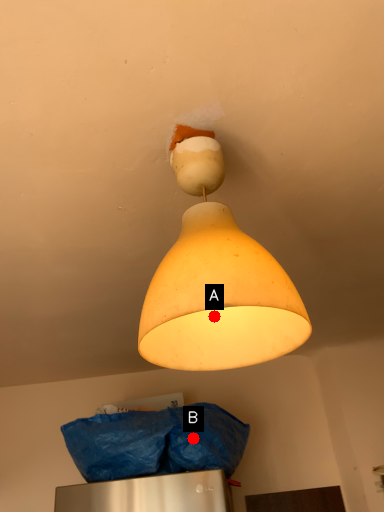
Question: Two points are circled on the image, labeled by A and B beside each circle. Which point is further to the camera?

Choices:
 (A) A is further
 (B) B is further

Answer: (B)